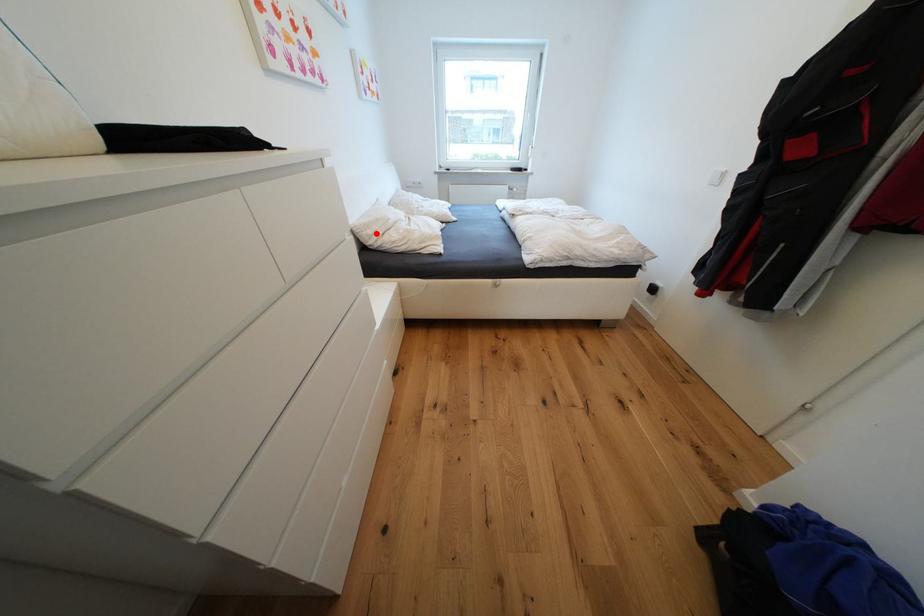
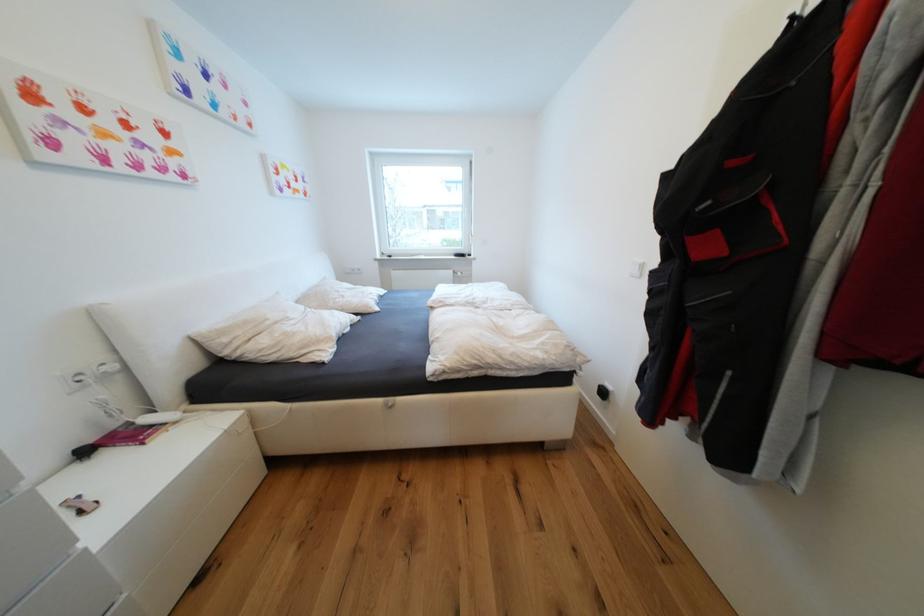
Question: I am providing you with two images of the same scene from different viewpoints. Image1 has a red point marked. In image2, the corresponding 3D location appears at what relative position? Reply with the corresponding letter.

Choices:
 (A) Closer
 (B) Farther

Answer: (B)